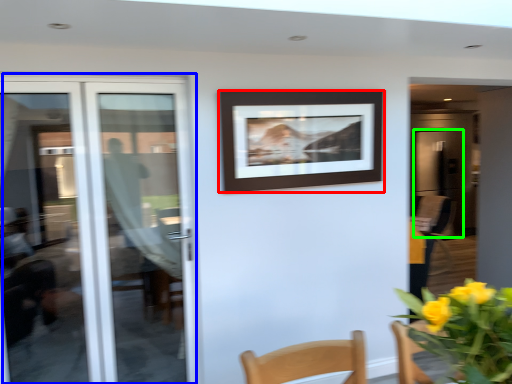
Question: Which object is positioned farthest from picture frame (highlighted by a red box)? Select from door (highlighted by a blue box) and screen door (highlighted by a green box).

Choices:
 (A) door
 (B) screen door

Answer: (B)